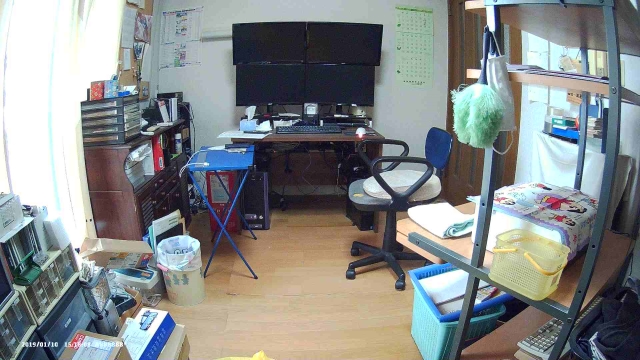
This screenshot has height=360, width=640. I want to click on basket, so click(x=538, y=269).